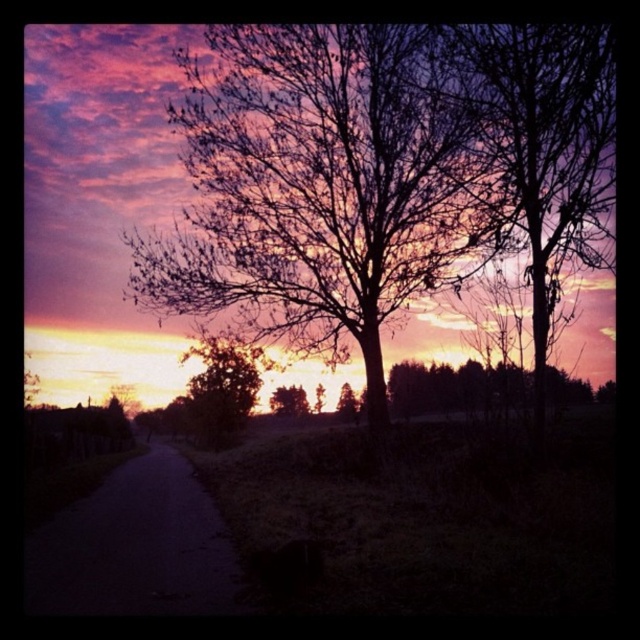
From the picture: You are standing at the center of the image and want to walk towards the dark asphalt road at lower left. In which general direction should you move?

You should move towards the lower left direction to reach the dark asphalt road at lower left since it is located at point (134,547).

You are a hiker standing at the start of the winding road in the rural scene. You want to walk towards the green matte tree at center. Is the green leafy tree at lower left blocking your path?

The green leafy tree at lower left is in front of the green matte tree at center, so it would block your path towards the green matte tree at center.